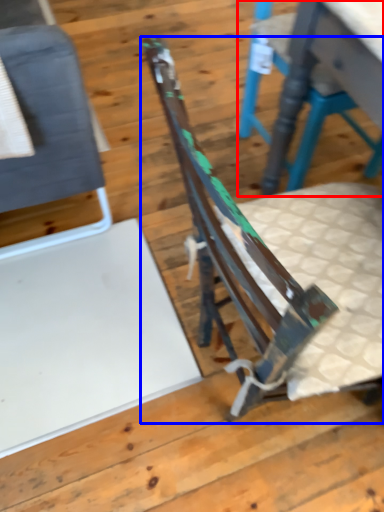
Question: Among these objects, which one is nearest to the camera, chair (highlighted by a red box) or chair (highlighted by a blue box)?

Choices:
 (A) chair
 (B) chair

Answer: (B)